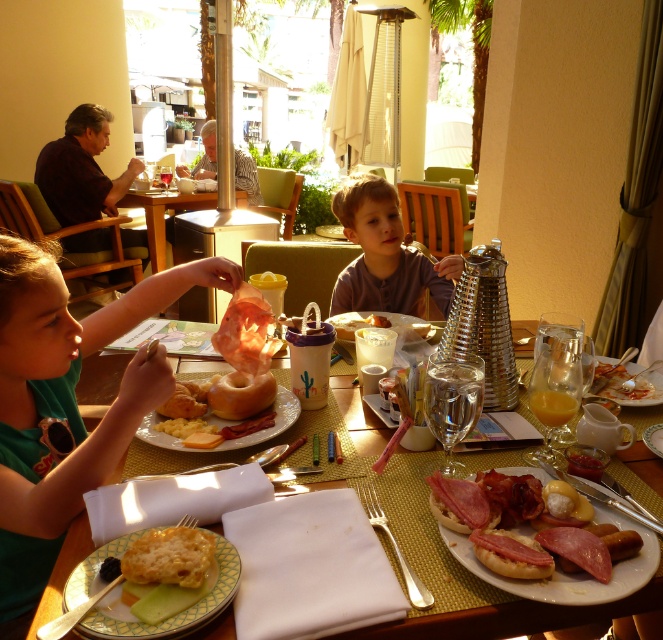
Which of these two, green matte shirt at upper left or purple matte shirt at center, stands shorter?

purple matte shirt at center is shorter.

Is green matte shirt at upper left wider than purple matte shirt at center?

In fact, green matte shirt at upper left might be narrower than purple matte shirt at center.

Is point (237, 275) positioned in front of point (371, 305)?

Yes, point (237, 275) is in front of point (371, 305).

At what (x,y) coordinates should I click in order to perform the action: click on green matte shirt at upper left. Please return your answer as a coordinate pair (x, y). Looking at the image, I should click on (66, 404).

Does matte plastic fork at lower center appear over smooth pink ham at center?

Indeed, matte plastic fork at lower center is positioned over smooth pink ham at center.

Which is behind, point (373, 419) or point (619, 564)?

Positioned behind is point (373, 419).

Locate an element on the screen. The image size is (663, 640). matte plastic fork at lower center is located at coordinates (512, 618).

Between green matte shirt at upper left and yellowish matte bread at lower left, which one appears on the left side from the viewer's perspective?

green matte shirt at upper left is more to the left.

Does green matte shirt at upper left have a larger size compared to yellowish matte bread at lower left?

Yes.

Describe the element at coordinates (66, 404) in the screenshot. I see `green matte shirt at upper left` at that location.

Find the location of a particular element. green matte shirt at upper left is located at coordinates (66, 404).